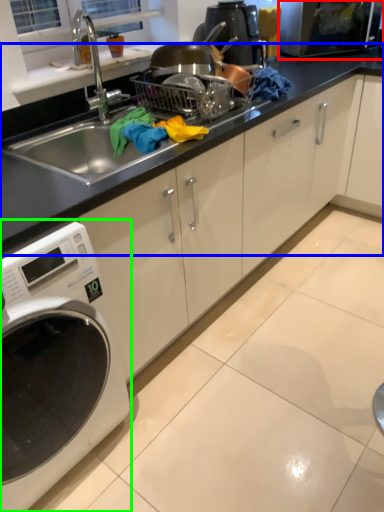
Question: Estimate the real-world distances between objects in this image. Which object is farther from microwave oven (highlighted by a red box), countertop (highlighted by a blue box) or home appliance (highlighted by a green box)?

Choices:
 (A) countertop
 (B) home appliance

Answer: (B)